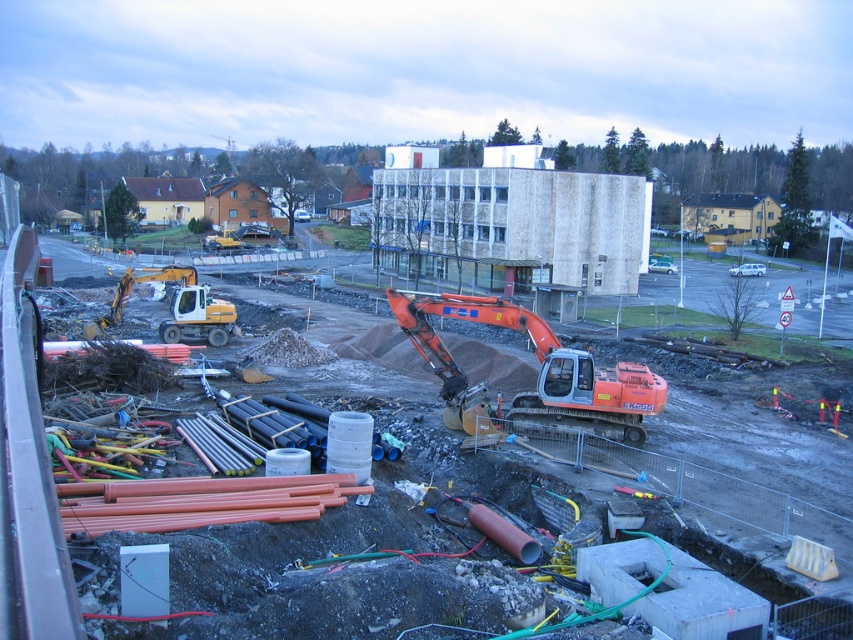
In the scene shown: You are standing at the center of the construction site and want to move towards the two points labeled in the scene. Which point, point (566, 403) or point (209, 340), will you reach first?

Point (566, 403) is closer to the viewer than point (209, 340), so you will reach point (566, 403) first.